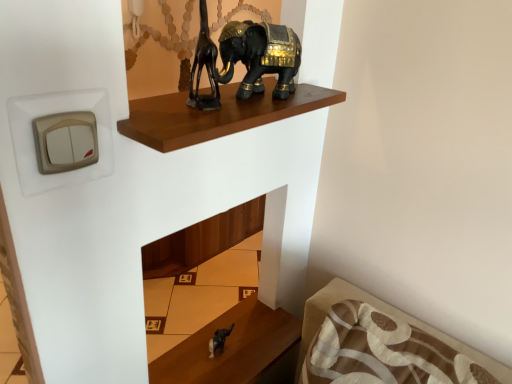
Find the location of a particular element. This screenshot has height=384, width=512. vacant space situated above satin black elephant at lower center (from a real-world perspective) is located at coordinates (249, 353).